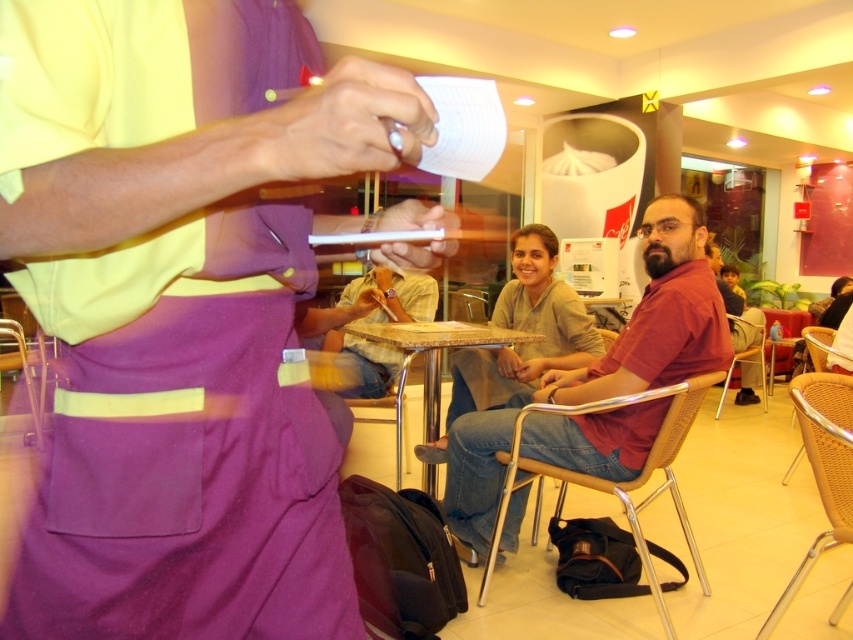
Question: In this image, where is matte brown shirt at center located relative to marble-patterned table at center?

Choices:
 (A) above
 (B) below

Answer: (A)

Question: Among these objects, which one is nearest to the camera?

Choices:
 (A) marble-patterned table at center
 (B) matte red shirt at center
 (C) matte brown shirt at center

Answer: (B)

Question: Which of these objects is positioned farthest from the marble-patterned table at center?

Choices:
 (A) matte red shirt at center
 (B) matte brown shirt at center

Answer: (A)

Question: Estimate the real-world distances between objects in this image. Which object is farther from the matte red shirt at center?

Choices:
 (A) marble-patterned table at center
 (B) matte brown shirt at center

Answer: (B)

Question: Considering the relative positions of matte brown shirt at center and marble-patterned table at center in the image provided, where is matte brown shirt at center located with respect to marble-patterned table at center?

Choices:
 (A) above
 (B) below

Answer: (A)

Question: Considering the relative positions of matte red shirt at center and matte brown shirt at center in the image provided, where is matte red shirt at center located with respect to matte brown shirt at center?

Choices:
 (A) right
 (B) left

Answer: (A)